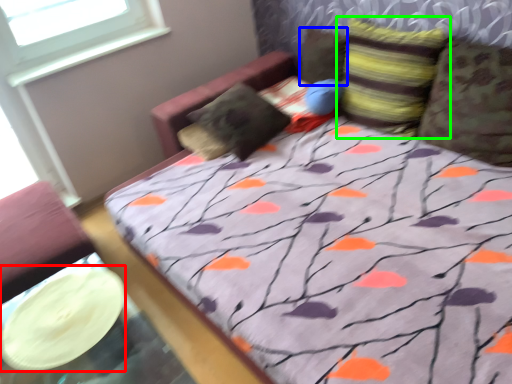
Question: Estimate the real-world distances between objects in this image. Which object is closer to platter (highlighted by a red box), pillow (highlighted by a blue box) or pillow (highlighted by a green box)?

Choices:
 (A) pillow
 (B) pillow

Answer: (B)